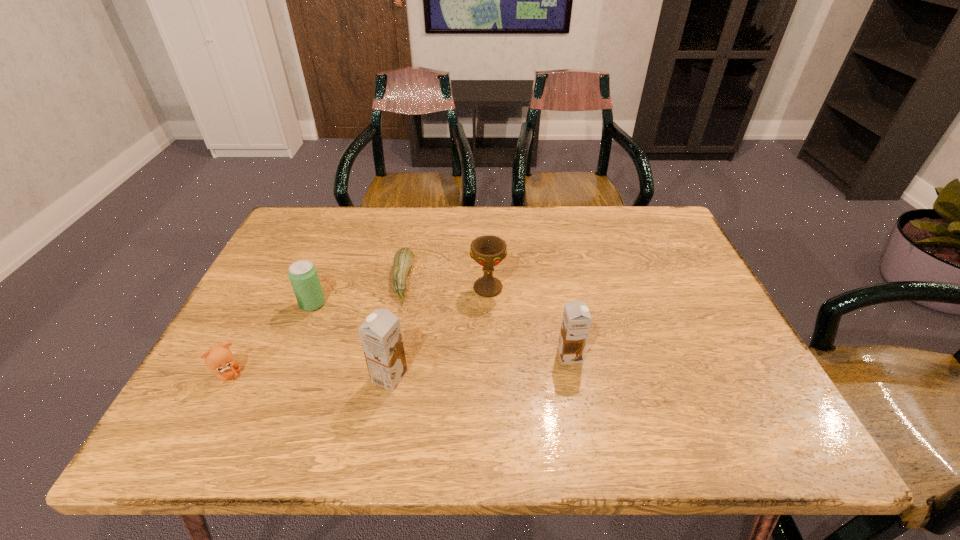
Where is `the left chocolate milk`? This screenshot has height=540, width=960. the left chocolate milk is located at coordinates (380, 334).

The image size is (960, 540). I want to click on the tallest object, so click(380, 334).

You are a GUI agent. You are given a task and a screenshot of the screen. Output one action in this format:
    pyautogui.click(x=<x>, y=<y>)
    Task: Click on the right chocolate milk
    This screenshot has height=540, width=960.
    Given the screenshot: What is the action you would take?
    pyautogui.click(x=576, y=321)

Where is `the shorter chocolate milk`? the shorter chocolate milk is located at coordinates (576, 321).

The image size is (960, 540). Find the location of `soda`. soda is located at coordinates (303, 275).

What are the coordinates of `the fifth object from right to left` in the screenshot? It's located at tap(303, 275).

The width and height of the screenshot is (960, 540). I want to click on the second object from right to left, so click(x=488, y=250).

The height and width of the screenshot is (540, 960). In order to click on the leftmost object in this screenshot , I will do `click(219, 359)`.

The width and height of the screenshot is (960, 540). What are the coordinates of `the second shortest object` in the screenshot? It's located at (219, 359).

Locate an element on the screen. This screenshot has width=960, height=540. the shortest object is located at coordinates (404, 257).